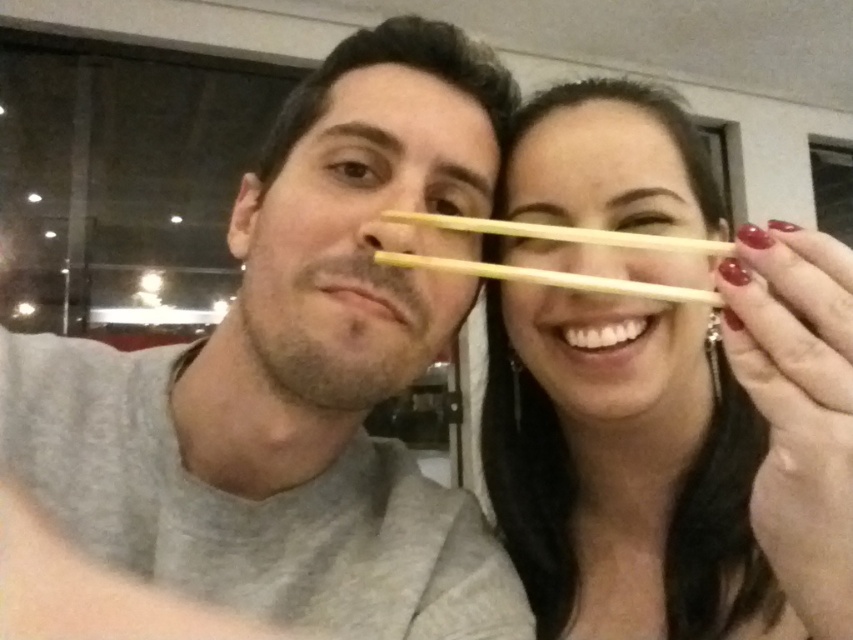
Please provide the 2D coordinates of the matte gray shirt at center in the image. The coordinates should be in the format of a point with two decimal places, such as point 0.5,0.5.

The matte gray shirt at center is located at point [277,394].

Based on the photo, you are taking a photo of two people in a restaurant. You notice two points in the image at coordinates point [321,221] and point [587,444]. Which point is closer to you?

Point [321,221] is closer to the viewer than point [587,444].

You are a photographer trying to capture a clear photo of the matte gray shirt at center and the wooden chopsticks at center. Which object is closer to the camera?

The matte gray shirt at center is closer to the camera because the wooden chopsticks at center are positioned behind it.